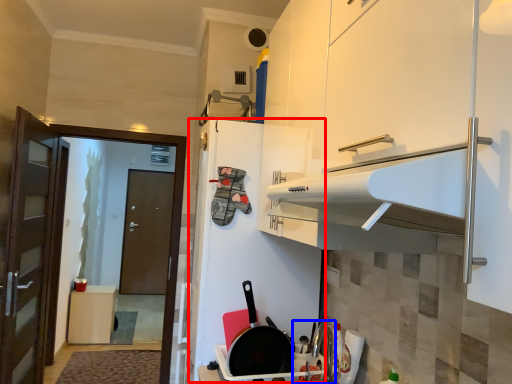
Question: Which object is closer to the camera taking this photo, fridge (highlighted by a red box) or sink (highlighted by a blue box)?

Choices:
 (A) fridge
 (B) sink

Answer: (B)